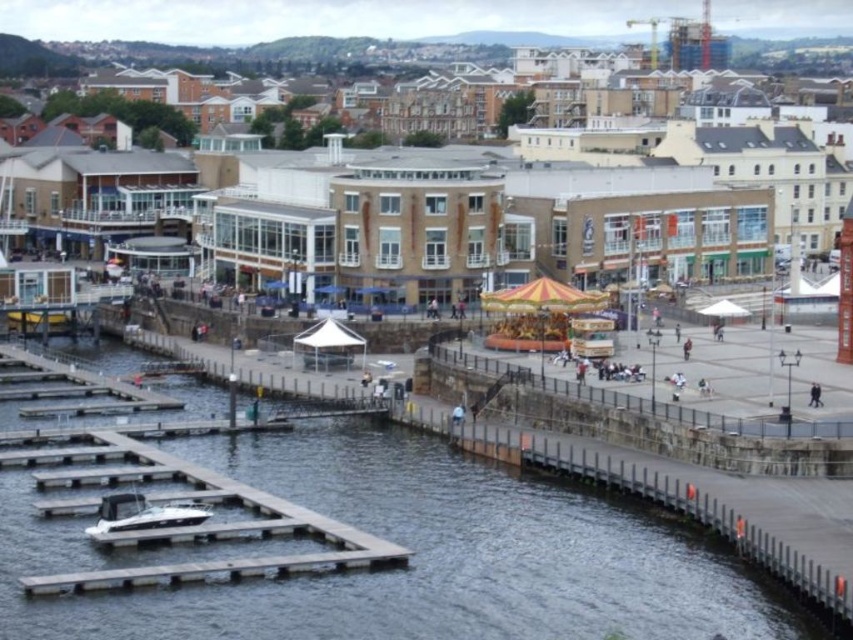
You are a photographer standing on the promenade and want to capture both the clear water at lower left and the white glossy boat at lower left in a single shot. Which object should you position closer to the left edge of your camera frame to ensure both are included?

The clear water at lower left should be positioned closer to the left edge of your camera frame since it is already on the left side of the white glossy boat at lower left, ensuring both are included in the shot.